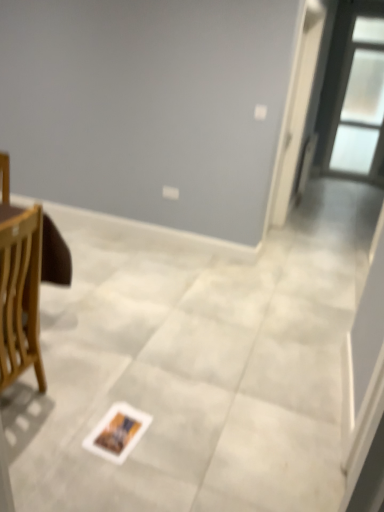
Question: Does white paper postcard at center have a greater height compared to white glossy screen door at upper right?

Choices:
 (A) yes
 (B) no

Answer: (B)

Question: Does white paper postcard at center have a larger size compared to white glossy screen door at upper right?

Choices:
 (A) yes
 (B) no

Answer: (B)

Question: From a real-world perspective, is white paper postcard at center below white glossy screen door at upper right?

Choices:
 (A) yes
 (B) no

Answer: (A)

Question: Is white glossy screen door at upper right at the back of white paper postcard at center?

Choices:
 (A) no
 (B) yes

Answer: (A)

Question: Does white paper postcard at center have a lesser height compared to white glossy screen door at upper right?

Choices:
 (A) yes
 (B) no

Answer: (A)

Question: Considering the relative positions of white paper postcard at center and white glossy screen door at upper right in the image provided, is white paper postcard at center to the right of white glossy screen door at upper right from the viewer's perspective?

Choices:
 (A) yes
 (B) no

Answer: (B)

Question: Considering the relative sizes of white glossy screen door at upper right and white paper postcard at center in the image provided, is white glossy screen door at upper right shorter than white paper postcard at center?

Choices:
 (A) no
 (B) yes

Answer: (A)

Question: From a real-world perspective, is white glossy screen door at upper right located higher than white paper postcard at center?

Choices:
 (A) yes
 (B) no

Answer: (A)

Question: Is white glossy screen door at upper right facing away from white paper postcard at center?

Choices:
 (A) no
 (B) yes

Answer: (A)

Question: Is white glossy screen door at upper right positioned in front of white paper postcard at center?

Choices:
 (A) no
 (B) yes

Answer: (A)

Question: Is white glossy screen door at upper right located outside white paper postcard at center?

Choices:
 (A) no
 (B) yes

Answer: (B)

Question: Considering the relative sizes of white glossy screen door at upper right and white paper postcard at center in the image provided, is white glossy screen door at upper right taller than white paper postcard at center?

Choices:
 (A) no
 (B) yes

Answer: (B)

Question: Is transparent glass window at upper right smaller than white paper postcard at center?

Choices:
 (A) yes
 (B) no

Answer: (B)